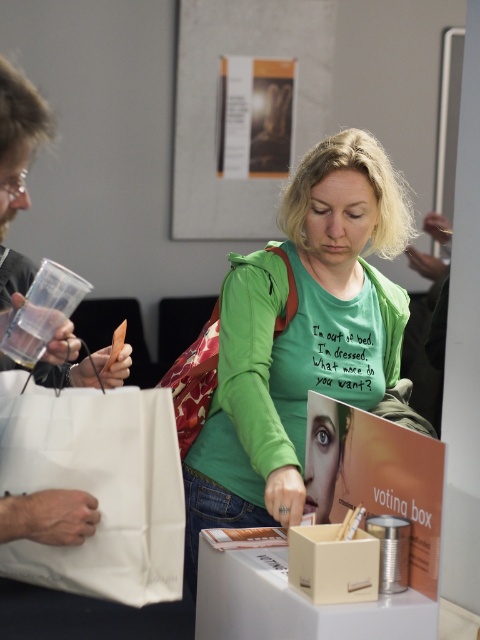
Question: Is green matte t-shirt at center thinner than beige cardboard box at center?

Choices:
 (A) yes
 (B) no

Answer: (B)

Question: Is white paper bag at left to the right of printed fabric bag at center from the viewer's perspective?

Choices:
 (A) yes
 (B) no

Answer: (B)

Question: Can you confirm if white paper bag at lower left is wider than beige cardboard box at center?

Choices:
 (A) no
 (B) yes

Answer: (B)

Question: Which object is closer to the camera taking this photo?

Choices:
 (A) beige cardboard box at center
 (B) white paper bag at lower left
 (C) white paper bag at left

Answer: (C)

Question: Which point is farther to the camera?

Choices:
 (A) white paper bag at lower left
 (B) printed fabric bag at center
 (C) green matte t-shirt at center
 (D) beige cardboard box at center

Answer: (B)

Question: Which point is farther from the camera taking this photo?

Choices:
 (A) (19, 378)
 (B) (349, 540)
 (C) (4, 148)

Answer: (A)